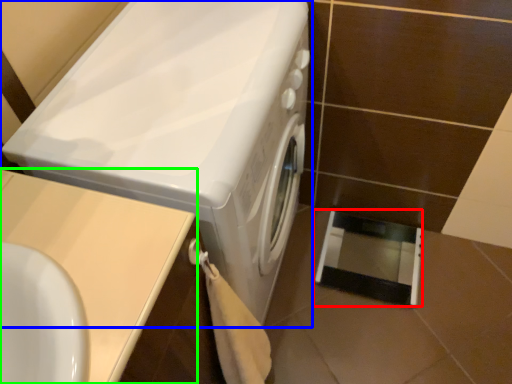
Question: Which object is the closest to the screen door (highlighted by a red box)? Choose among these: washing machine (highlighted by a blue box) or counter top (highlighted by a green box).

Choices:
 (A) washing machine
 (B) counter top

Answer: (A)